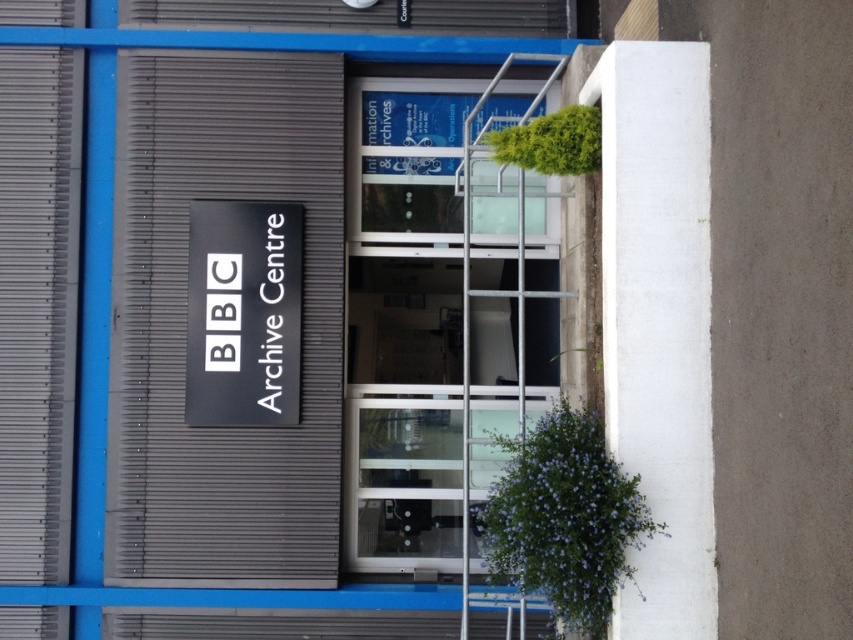
Locate an element on the screen. The width and height of the screenshot is (853, 640). transparent glass door at center is located at coordinates (428, 401).

Between transparent glass door at center and black matte sign at center, which one appears on the right side from the viewer's perspective?

From the viewer's perspective, transparent glass door at center appears more on the right side.

Between point (395, 512) and point (250, 413), which one is positioned in front?

Positioned in front is point (250, 413).

This screenshot has width=853, height=640. Find the location of `transparent glass door at center`. transparent glass door at center is located at coordinates (428, 401).